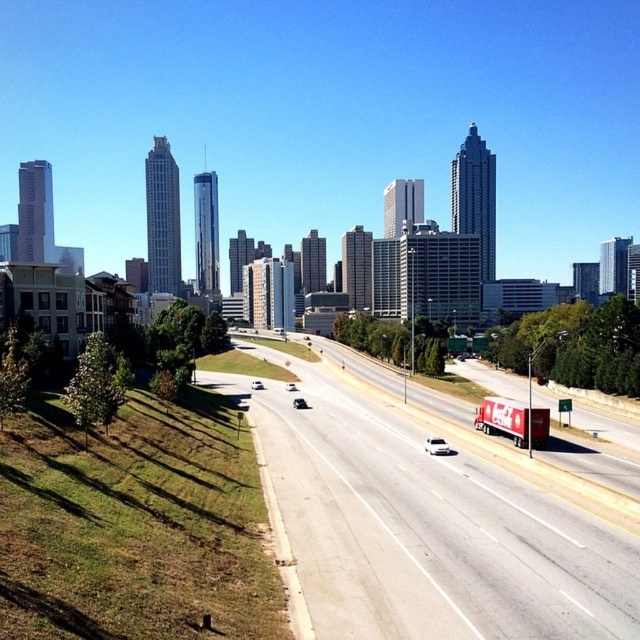
You are a city planner analyzing the highway and sedan in the image. Given that the shiny silver sedan at center is 4 meters long, what is the minimum length of the white asphalt highway at center?

The white asphalt highway at center is larger in size than shiny silver sedan at center, so the minimum length of the white asphalt highway at center must be greater than 4 meters.

Looking at this image, you are a delivery driver needing to make a quick turn on the road. Considering the white asphalt highway at center and the white glossy car at center, which one has a wider path available for maneuvering?

The white asphalt highway at center has a wider path available for maneuvering because its width is larger than the white glossy car at center.